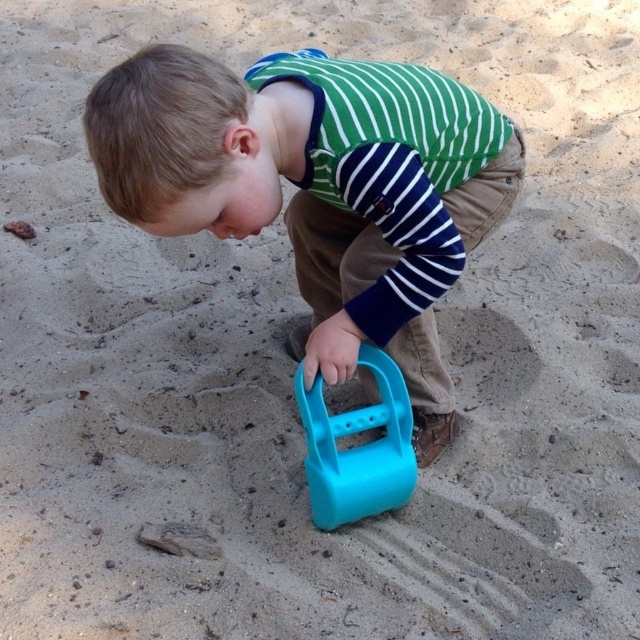
Question: Which of the following is the farthest from the observer?

Choices:
 (A) (164, 74)
 (B) (301, 385)

Answer: (B)

Question: From the image, what is the correct spatial relationship of matte plastic shovel at center in relation to blue plastic shovel at center?

Choices:
 (A) left
 (B) right

Answer: (A)

Question: Does matte plastic shovel at center have a smaller size compared to blue plastic shovel at center?

Choices:
 (A) no
 (B) yes

Answer: (A)

Question: Which point is closer to the camera?

Choices:
 (A) matte plastic shovel at center
 (B) blue plastic shovel at center

Answer: (A)

Question: In this image, where is matte plastic shovel at center located relative to blue plastic shovel at center?

Choices:
 (A) right
 (B) left

Answer: (B)